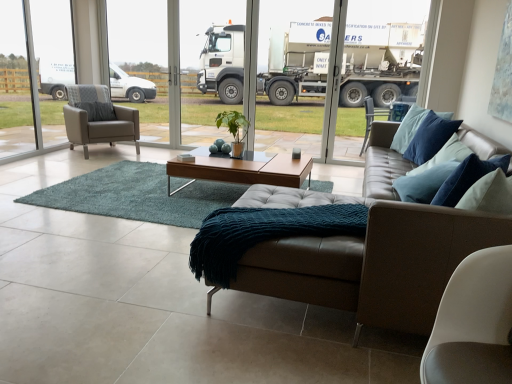
Question: Can you confirm if teal knitted blanket at center is bigger than matte gray armchair at left?

Choices:
 (A) no
 (B) yes

Answer: (A)

Question: Does teal knitted blanket at center have a greater width compared to matte gray armchair at left?

Choices:
 (A) no
 (B) yes

Answer: (B)

Question: From a real-world perspective, does teal knitted blanket at center stand above matte gray armchair at left?

Choices:
 (A) yes
 (B) no

Answer: (B)

Question: From the image's perspective, is teal knitted blanket at center located above matte gray armchair at left?

Choices:
 (A) no
 (B) yes

Answer: (A)

Question: Is teal knitted blanket at center surrounding matte gray armchair at left?

Choices:
 (A) yes
 (B) no

Answer: (B)

Question: Does teal knitted blanket at center appear on the right side of matte gray armchair at left?

Choices:
 (A) no
 (B) yes

Answer: (B)

Question: Would you say light brown wood coffee table at center is outside matte gray armchair at left?

Choices:
 (A) no
 (B) yes

Answer: (B)

Question: Is light brown wood coffee table at center to the left of matte gray armchair at left from the viewer's perspective?

Choices:
 (A) yes
 (B) no

Answer: (B)

Question: From the image's perspective, is light brown wood coffee table at center located beneath matte gray armchair at left?

Choices:
 (A) yes
 (B) no

Answer: (A)

Question: From a real-world perspective, is light brown wood coffee table at center under matte gray armchair at left?

Choices:
 (A) no
 (B) yes

Answer: (B)

Question: Can you confirm if light brown wood coffee table at center is shorter than matte gray armchair at left?

Choices:
 (A) no
 (B) yes

Answer: (B)

Question: From a real-world perspective, is light brown wood coffee table at center positioned over matte gray armchair at left based on gravity?

Choices:
 (A) no
 (B) yes

Answer: (A)

Question: Is teal knitted blanket at center next to matte gray armchair at left?

Choices:
 (A) yes
 (B) no

Answer: (B)